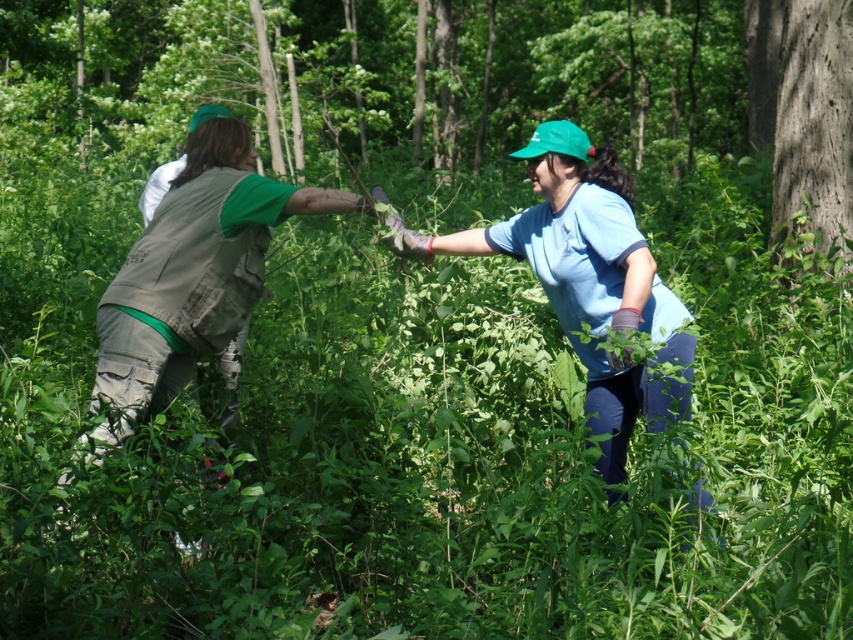
Question: Considering the real-world distances, which object is farthest from the smooth brown bark at right?

Choices:
 (A) green fabric vest at center
 (B) blue cotton shirt at center

Answer: (B)

Question: Does green fabric vest at center appear on the left side of blue cotton shirt at center?

Choices:
 (A) yes
 (B) no

Answer: (A)

Question: Among these objects, which one is nearest to the camera?

Choices:
 (A) green fabric vest at center
 (B) smooth brown bark at right

Answer: (A)

Question: Is green fabric vest at center thinner than blue cotton shirt at center?

Choices:
 (A) yes
 (B) no

Answer: (B)

Question: Which object appears closest to the camera in this image?

Choices:
 (A) green fabric vest at center
 (B) blue cotton shirt at center

Answer: (B)

Question: Is green fabric vest at center behind smooth brown bark at right?

Choices:
 (A) yes
 (B) no

Answer: (B)